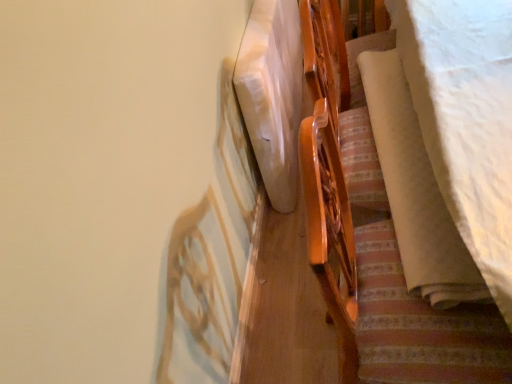
Question: Is wooden bed frame at upper right positioned with its back to white soft fabric at right?

Choices:
 (A) yes
 (B) no

Answer: (B)

Question: Considering the relative positions of wooden bed frame at upper right and white soft fabric at right in the image provided, is wooden bed frame at upper right to the right of white soft fabric at right from the viewer's perspective?

Choices:
 (A) yes
 (B) no

Answer: (B)

Question: From the image's perspective, does wooden bed frame at upper right appear lower than white soft fabric at right?

Choices:
 (A) yes
 (B) no

Answer: (A)

Question: Is wooden bed frame at upper right not inside white soft fabric at right?

Choices:
 (A) yes
 (B) no

Answer: (A)

Question: From the image's perspective, would you say wooden bed frame at upper right is positioned over white soft fabric at right?

Choices:
 (A) no
 (B) yes

Answer: (A)

Question: Could you tell me if wooden bed frame at upper right is turned towards white soft fabric at right?

Choices:
 (A) no
 (B) yes

Answer: (B)

Question: Can you confirm if wooden bed frame at upper right is positioned to the left of white matte mattress at center?

Choices:
 (A) yes
 (B) no

Answer: (B)

Question: Is wooden bed frame at upper right positioned beyond the bounds of white matte mattress at center?

Choices:
 (A) no
 (B) yes

Answer: (B)

Question: Are wooden bed frame at upper right and white matte mattress at center located far from each other?

Choices:
 (A) yes
 (B) no

Answer: (B)

Question: Can you confirm if wooden bed frame at upper right is thinner than white matte mattress at center?

Choices:
 (A) no
 (B) yes

Answer: (A)

Question: Does wooden bed frame at upper right have a larger size compared to white matte mattress at center?

Choices:
 (A) no
 (B) yes

Answer: (B)

Question: From the image's perspective, is wooden bed frame at upper right beneath white matte mattress at center?

Choices:
 (A) no
 (B) yes

Answer: (B)

Question: Does white soft fabric at right have a smaller size compared to white matte mattress at center?

Choices:
 (A) no
 (B) yes

Answer: (B)